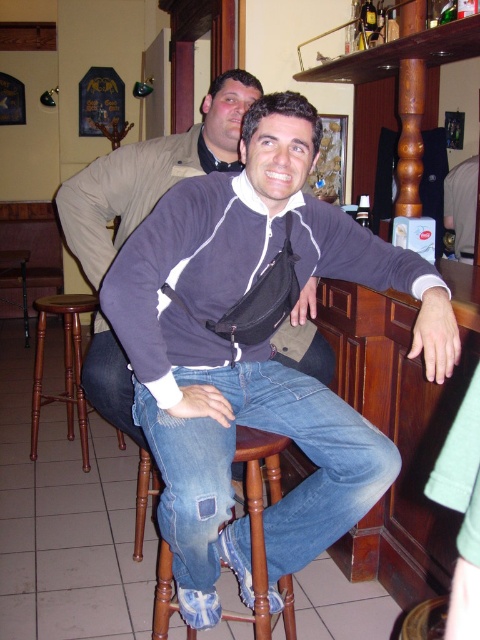
Based on the coordinates provided, which object is exactly at point (254, 355)?

The dark blue fleece at center is exactly at point (254, 355).

You are a fashion designer observing the man in the image. You need to determine which item of clothing is bigger between the dark blue fleece at center and the blue denim jeans at center. Which one is larger?

The dark blue fleece at center is larger in size than the blue denim jeans at center.